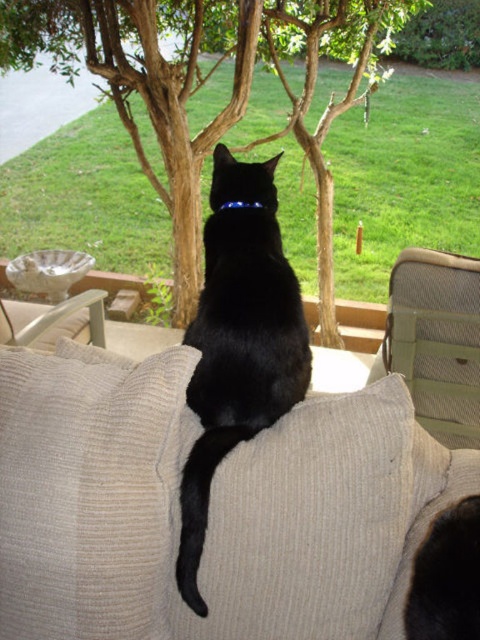
Looking at this image, between beige ribbed couch at center and beige mesh armchair at right, which one is positioned higher?

beige mesh armchair at right

Is beige ribbed couch at center below beige mesh armchair at right?

Correct, beige ribbed couch at center is located below beige mesh armchair at right.

Does point (314, 592) lie in front of point (472, 392)?

Yes, point (314, 592) is in front of point (472, 392).

Where is `beige ribbed couch at center`? beige ribbed couch at center is located at coordinates (210, 508).

Is brown rough tree at center taller than beige mesh armchair at right?

Yes, brown rough tree at center is taller than beige mesh armchair at right.

Which is behind, point (147, 83) or point (462, 276)?

The point (147, 83) is behind.

Where is `brown rough tree at center`? The width and height of the screenshot is (480, 640). brown rough tree at center is located at coordinates (204, 83).

Who is positioned more to the right, beige ribbed couch at center or beige corduroy armchair at left?

beige ribbed couch at center

Can you confirm if beige ribbed couch at center is positioned to the right of beige corduroy armchair at left?

Correct, you'll find beige ribbed couch at center to the right of beige corduroy armchair at left.

Locate an element on the screen. The image size is (480, 640). beige ribbed couch at center is located at coordinates (210, 508).